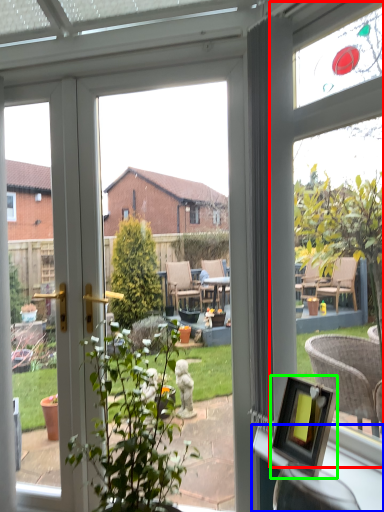
Question: Considering the real-world distances, which object is closest to bay window (highlighted by a red box)? window sill (highlighted by a blue box) or picture frame (highlighted by a green box).

Choices:
 (A) window sill
 (B) picture frame

Answer: (B)